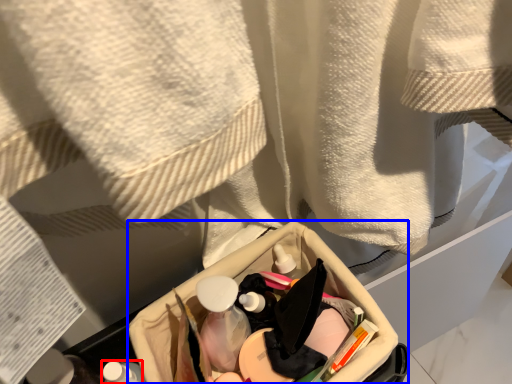
Question: Which of the following is the closest to the observer, toiletry (highlighted by a red box) or storage box (highlighted by a blue box)?

Choices:
 (A) toiletry
 (B) storage box

Answer: (A)